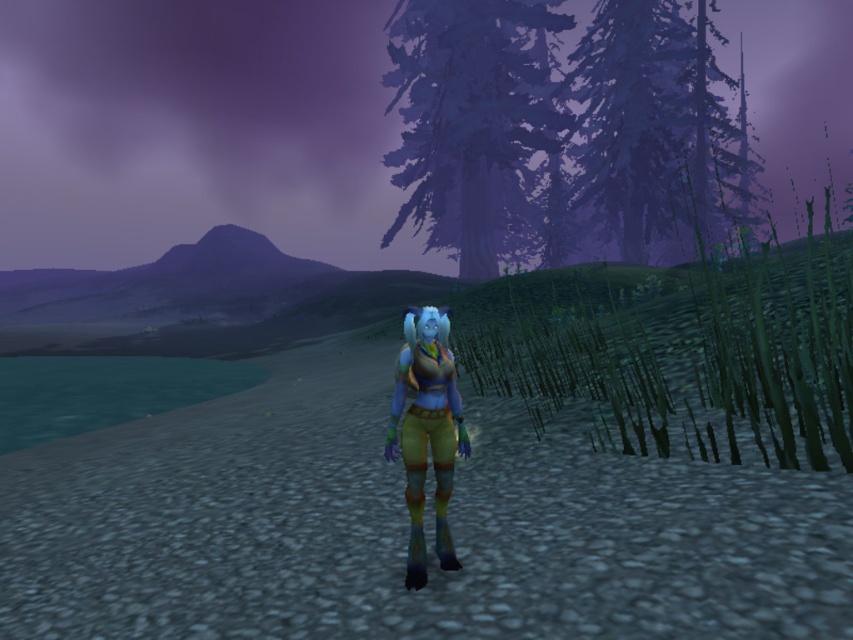
Question: Which object is farther from the camera taking this photo?

Choices:
 (A) purple matte tree at upper center
 (B) dark blue textured pine tree at upper right

Answer: (A)

Question: Which object is closer to the camera taking this photo?

Choices:
 (A) dark blue textured pine tree at upper right
 (B) purple matte tree at upper center

Answer: (A)

Question: Does purple matte tree at upper center appear over dark blue textured pine tree at upper right?

Choices:
 (A) yes
 (B) no

Answer: (B)

Question: Does purple matte tree at upper center have a larger size compared to dark blue textured pine tree at upper right?

Choices:
 (A) yes
 (B) no

Answer: (B)

Question: Is purple matte tree at upper center closer to camera compared to dark blue textured pine tree at upper right?

Choices:
 (A) no
 (B) yes

Answer: (A)